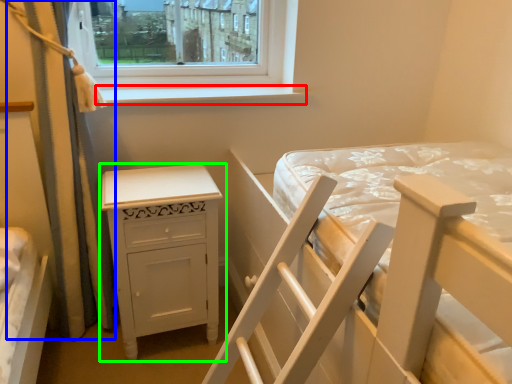
Question: Considering the real-world distances, which object is closest to window sill (highlighted by a red box)? curtain (highlighted by a blue box) or nightstand (highlighted by a green box).

Choices:
 (A) curtain
 (B) nightstand

Answer: (A)